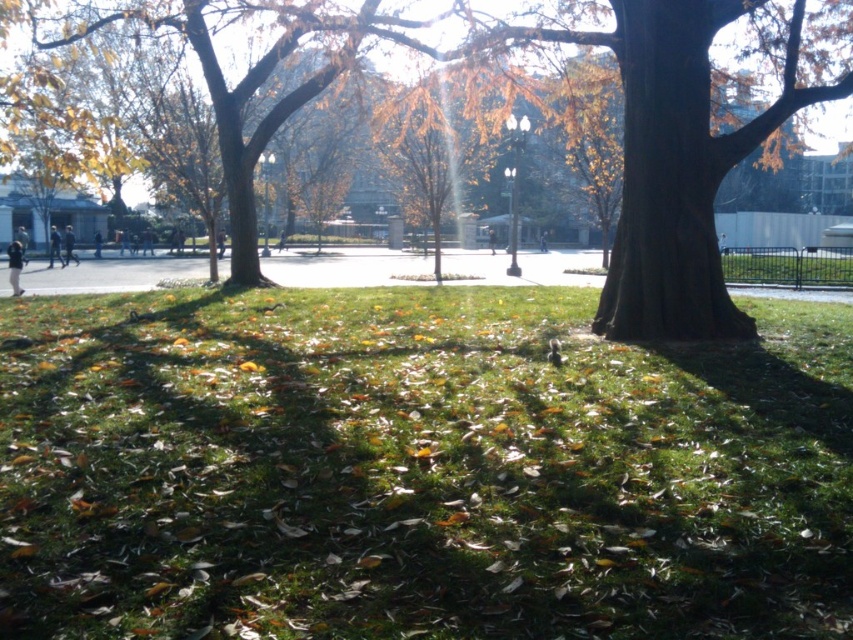
Question: Does dark gray jacket at left appear under black fabric person at center?

Choices:
 (A) no
 (B) yes

Answer: (B)

Question: Observing the image, what is the correct spatial positioning of green grassy at center in reference to dark gray fabric at center?

Choices:
 (A) left
 (B) right

Answer: (A)

Question: Is black leather jacket at left bigger than light brown leather jacket at center?

Choices:
 (A) no
 (B) yes

Answer: (B)

Question: Which point is closer to the camera?

Choices:
 (A) (20, 244)
 (B) (540, 250)

Answer: (A)

Question: Which point appears farthest from the camera in this image?

Choices:
 (A) (125, 499)
 (B) (96, 253)

Answer: (B)

Question: Which point is closer to the camera?

Choices:
 (A) dark blue jeans at left
 (B) brown rough tree at center
 (C) black leather jacket at left
 (D) light brown leather jacket at center

Answer: (B)